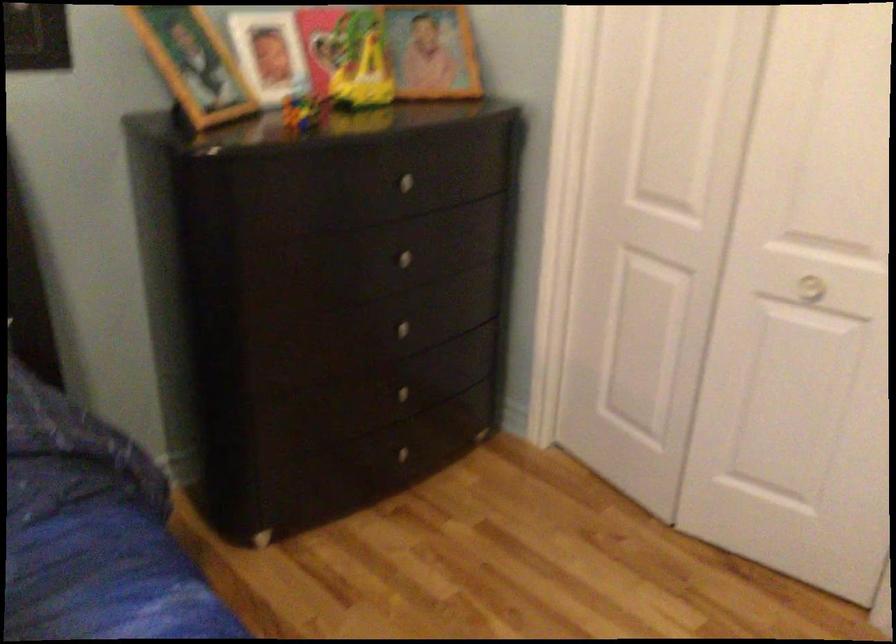
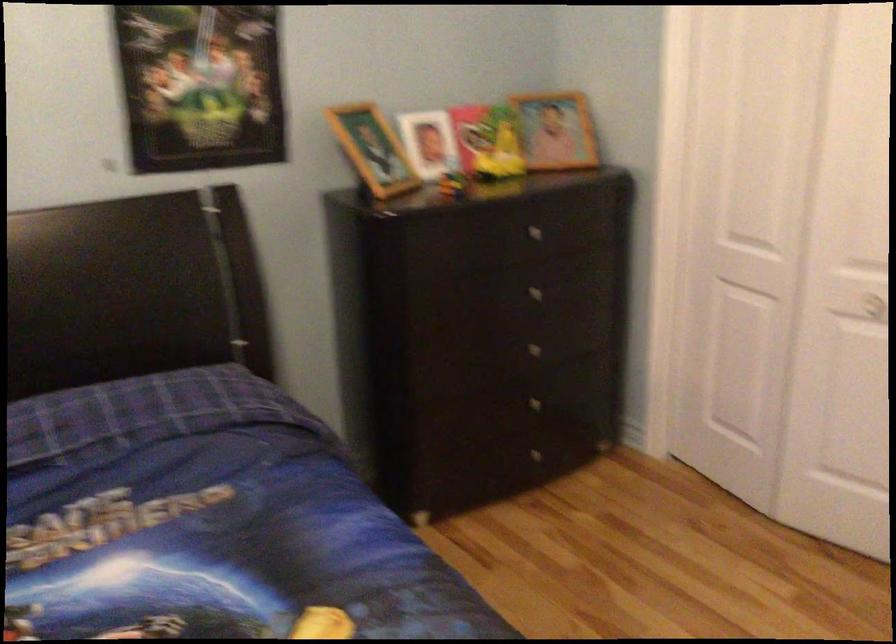
Where in the second image is the point corresponding to the point at 392,395 from the first image?

(528, 406)